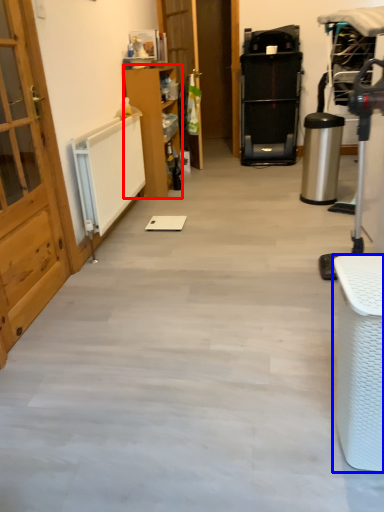
Question: Which object is further to the camera taking this photo, furniture (highlighted by a red box) or furniture (highlighted by a blue box)?

Choices:
 (A) furniture
 (B) furniture

Answer: (A)